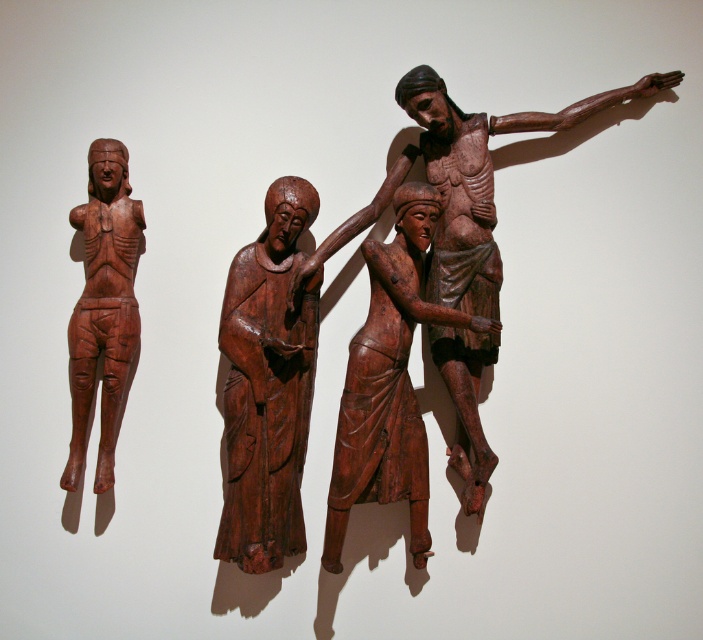
You are an art curator examining the arrangement of sculptures in the image. The smooth brown statue at center is crucial for the exhibit. Can you determine if it is positioned closer to the left edge or the right edge of the wall?

The smooth brown statue at center is located at point 0.603 on the horizontal axis, which is closer to the right edge of the wall since 0.603 is more than halfway between 0 and 1.

You are an art curator planning to rearrange the sculptures in the image. You want to place a new sculpture between the wooden crucifix at center and the matte wood figure at left. Based on their current positions, where should you position the new sculpture relative to the existing ones?

The wooden crucifix at center is located above the matte wood figure at left, so to place a new sculpture between them, you should position it between the wooden crucifix at center and the matte wood figure at left, either slightly below the crucifix and above the figure or along the vertical axis connecting them.